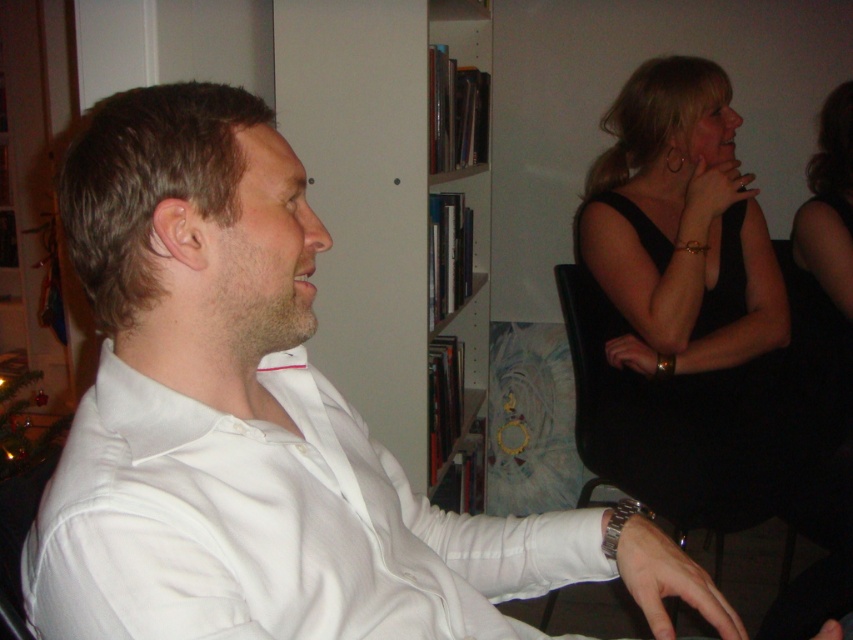
Which of these two, black satin dress at upper right or black leather chair at upper right, stands shorter?

black leather chair at upper right

Is black satin dress at upper right to the left of black leather chair at upper right from the viewer's perspective?

No, black satin dress at upper right is not to the left of black leather chair at upper right.

I want to click on black satin dress at upper right, so click(x=677, y=224).

Does white smooth shirt at center have a larger size compared to white glossy bookshelf at center?

Incorrect, white smooth shirt at center is not larger than white glossy bookshelf at center.

Which is above, white smooth shirt at center or white glossy bookshelf at center?

Positioned higher is white glossy bookshelf at center.

Where is `white smooth shirt at center`? white smooth shirt at center is located at coordinates (270, 528).

I want to click on white smooth shirt at center, so click(x=270, y=528).

Is white smooth shirt at center thinner than black leather chair at upper right?

Incorrect, white smooth shirt at center's width is not less than black leather chair at upper right's.

Between point (430, 570) and point (601, 472), which one is positioned in front?

Positioned in front is point (430, 570).

This screenshot has width=853, height=640. Find the location of `white smooth shirt at center`. white smooth shirt at center is located at coordinates (270, 528).